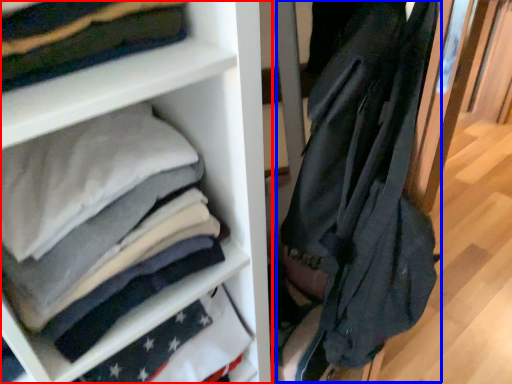
Question: Among these objects, which one is nearest to the camera, shelf (highlighted by a red box) or garment (highlighted by a blue box)?

Choices:
 (A) shelf
 (B) garment

Answer: (B)